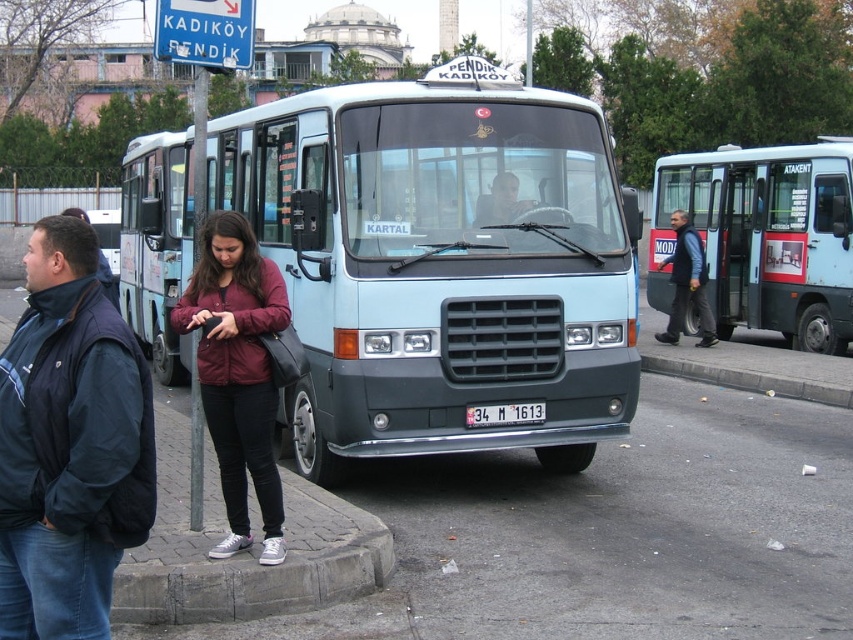
Question: Does light blue matte bus at center have a lesser width compared to light blue metallic bus at center?

Choices:
 (A) no
 (B) yes

Answer: (B)

Question: Which point is closer to the camera?

Choices:
 (A) dark blue jeans at right
 (B) dark blue jacket at left

Answer: (B)

Question: Which point appears closest to the camera in this image?

Choices:
 (A) (115, 435)
 (B) (245, 508)

Answer: (A)

Question: Does light blue metallic bus at center have a smaller size compared to gray concrete curb at lower right?

Choices:
 (A) no
 (B) yes

Answer: (B)

Question: Is light blue matte bus at center closer to the viewer compared to matte black face at center?

Choices:
 (A) yes
 (B) no

Answer: (B)

Question: Which point is farther to the camera?

Choices:
 (A) (227, 435)
 (B) (848, 388)

Answer: (B)